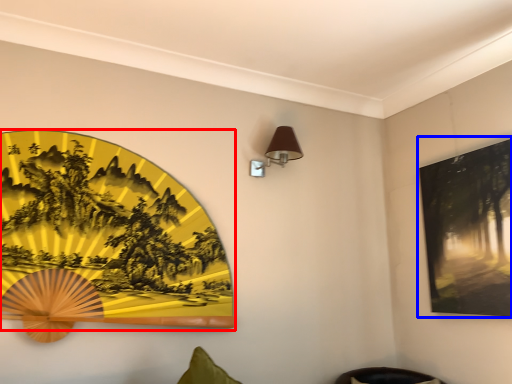
Question: Which object is further to the camera taking this photo, picture frame (highlighted by a red box) or picture frame (highlighted by a blue box)?

Choices:
 (A) picture frame
 (B) picture frame

Answer: (B)